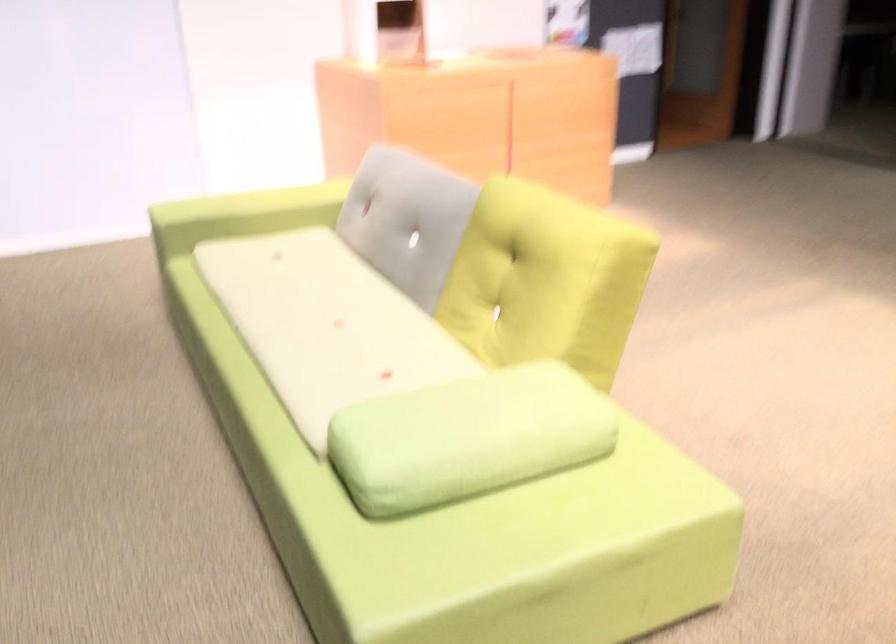
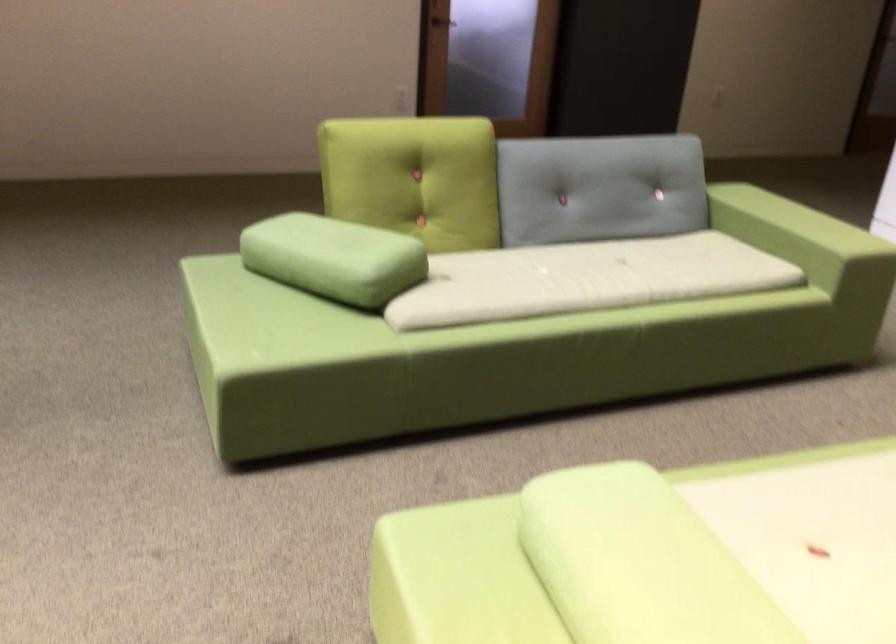
In the second image, find the point that corresponds to (471,406) in the first image.

(651, 556)